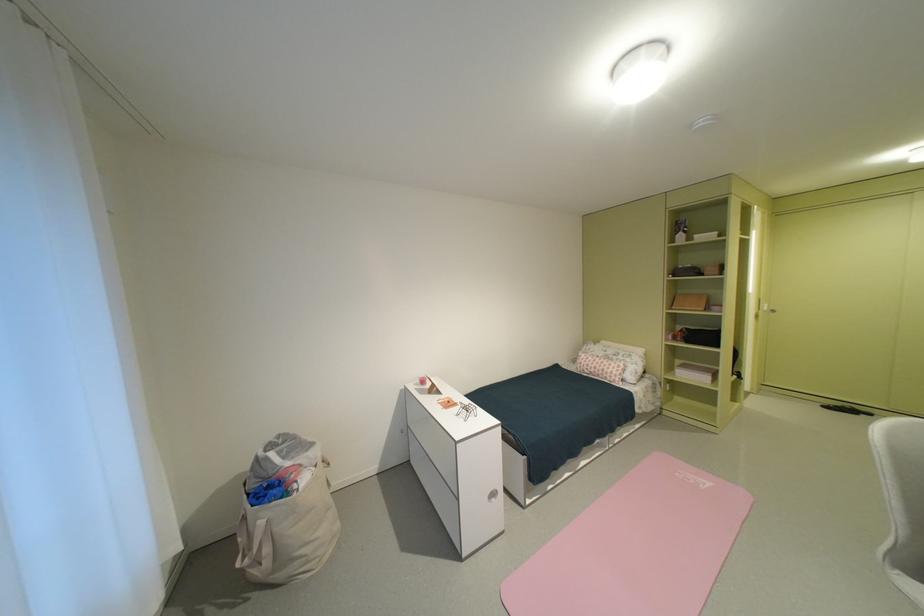
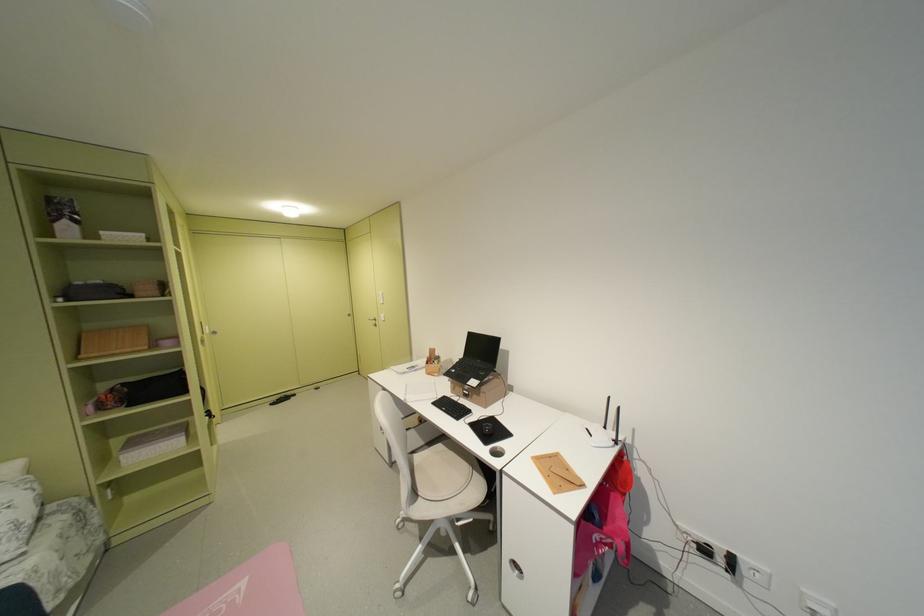
Question: The first image is from the beginning of the video and the second image is from the end. How did the camera likely rotate when shooting the video?

Choices:
 (A) Left
 (B) Right
 (C) Up
 (D) Down

Answer: (B)